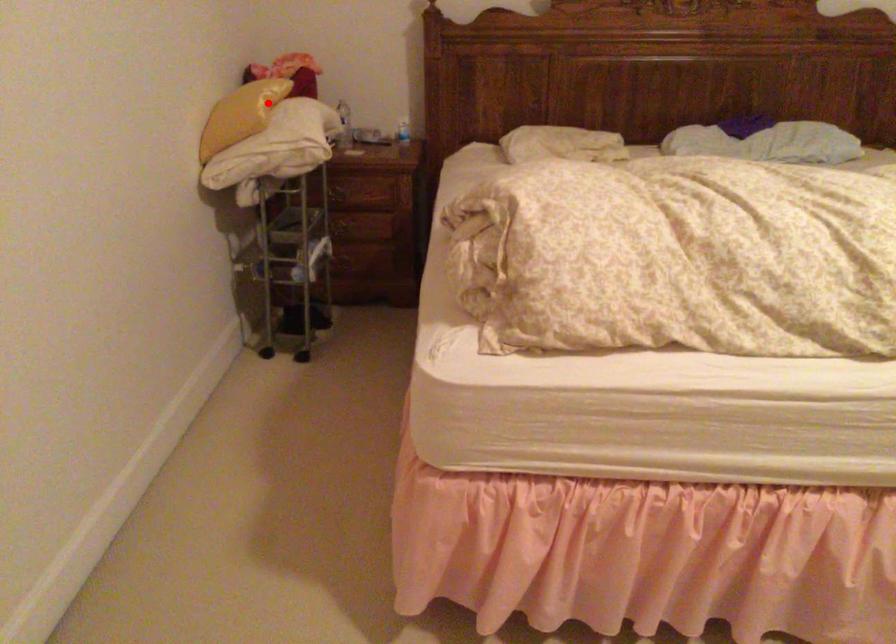
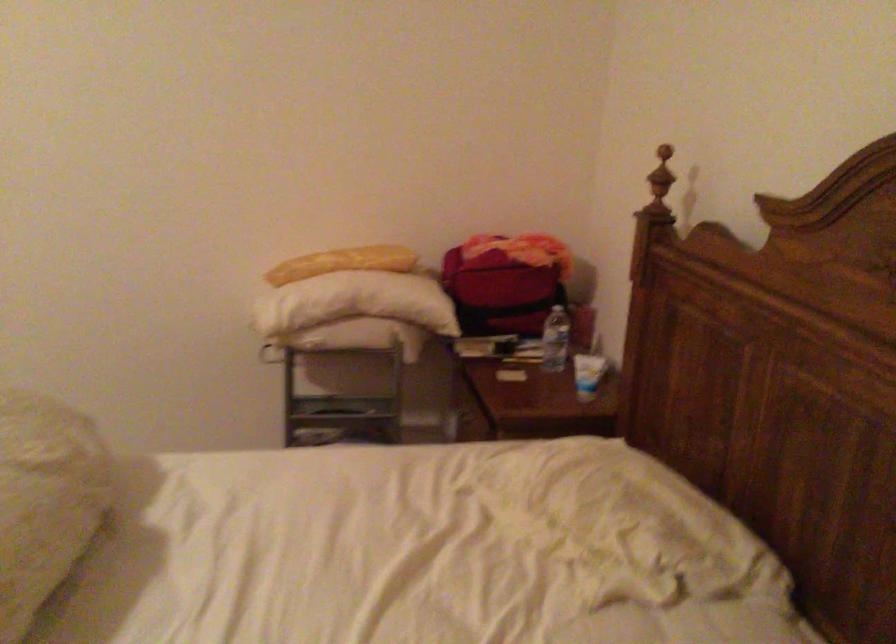
Question: A red point is marked in image1. In image2, is the corresponding 3D point closer to the camera or farther? Reply with the corresponding letter.

Choices:
 (A) The corresponding 3D point is closer.
 (B) The corresponding 3D point is farther.

Answer: (A)